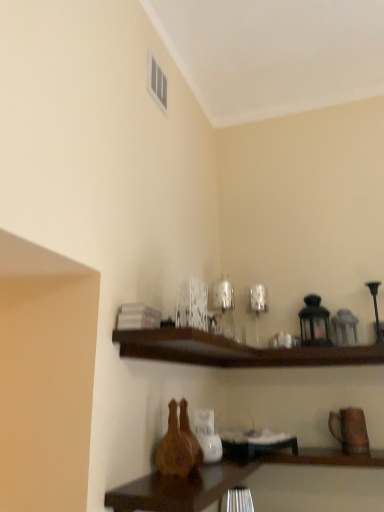
Question: Is wooden table at lower center further to camera compared to dark wood shelf at upper center?

Choices:
 (A) yes
 (B) no

Answer: (B)

Question: Is wooden table at lower center far away from dark wood shelf at upper center?

Choices:
 (A) no
 (B) yes

Answer: (A)

Question: Does wooden table at lower center appear on the right side of dark wood shelf at upper center?

Choices:
 (A) yes
 (B) no

Answer: (B)

Question: From a real-world perspective, does wooden table at lower center stand above dark wood shelf at upper center?

Choices:
 (A) no
 (B) yes

Answer: (A)

Question: Considering the relative sizes of wooden table at lower center and dark wood shelf at upper center in the image provided, is wooden table at lower center smaller than dark wood shelf at upper center?

Choices:
 (A) no
 (B) yes

Answer: (A)

Question: Does point (208, 362) appear closer or farther from the camera than point (332, 420)?

Choices:
 (A) farther
 (B) closer

Answer: (A)

Question: Looking at their shapes, would you say dark wood shelf at upper center is wider or thinner than brown matte vase at lower right?

Choices:
 (A) wide
 (B) thin

Answer: (A)

Question: In the image, is dark wood shelf at upper center on the left side or the right side of brown matte vase at lower right?

Choices:
 (A) right
 (B) left

Answer: (B)

Question: From their relative heights in the image, would you say dark wood shelf at upper center is taller or shorter than brown matte vase at lower right?

Choices:
 (A) tall
 (B) short

Answer: (B)

Question: Looking at the image, does matte white vent at upper center seem bigger or smaller compared to wooden table at lower center?

Choices:
 (A) big
 (B) small

Answer: (B)

Question: Considering the positions of matte white vent at upper center and wooden table at lower center in the image, is matte white vent at upper center taller or shorter than wooden table at lower center?

Choices:
 (A) short
 (B) tall

Answer: (B)

Question: In the image, is matte white vent at upper center positioned in front of or behind wooden table at lower center?

Choices:
 (A) behind
 (B) front

Answer: (A)

Question: Is matte white vent at upper center inside or outside of wooden table at lower center?

Choices:
 (A) outside
 (B) inside

Answer: (A)

Question: Considering the positions of brown matte vase at lower right and wooden table at lower center in the image, is brown matte vase at lower right taller or shorter than wooden table at lower center?

Choices:
 (A) tall
 (B) short

Answer: (A)

Question: Which is correct: brown matte vase at lower right is inside wooden table at lower center, or outside of it?

Choices:
 (A) inside
 (B) outside

Answer: (B)